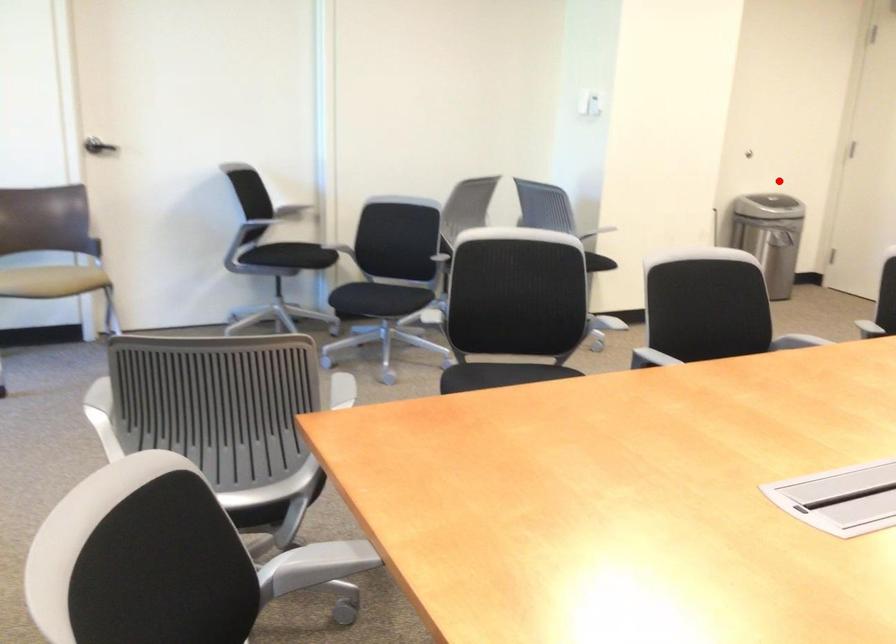
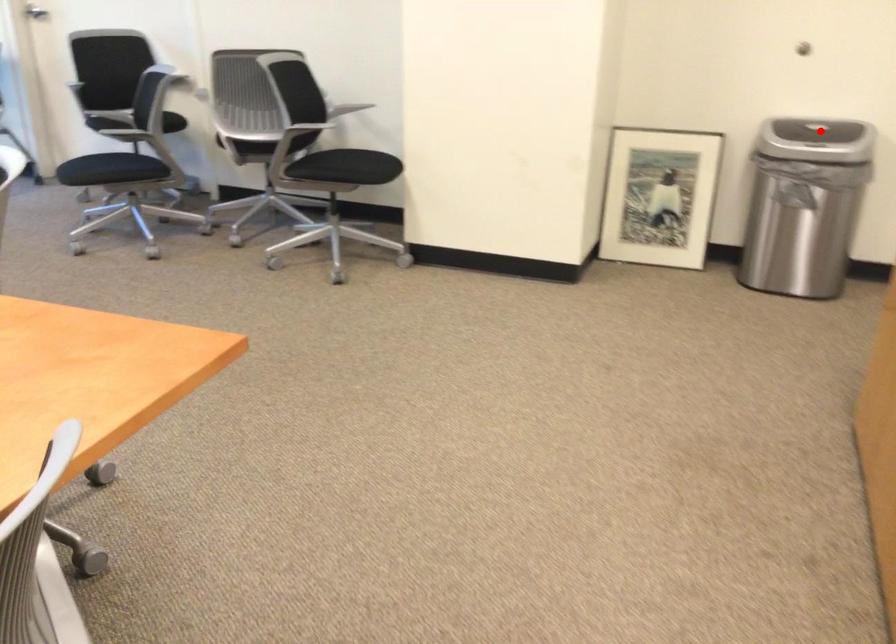
I am providing you with two images of the same scene from different viewpoints. A red point is marked on the first image and another point is marked on the second image. Are the points marked in image1 and image2 representing the same 3D position?

Yes